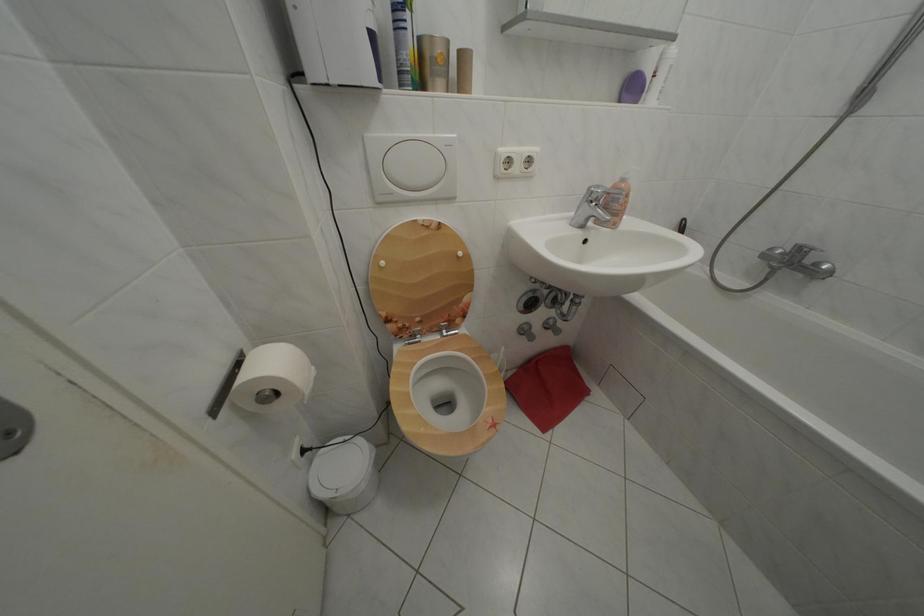
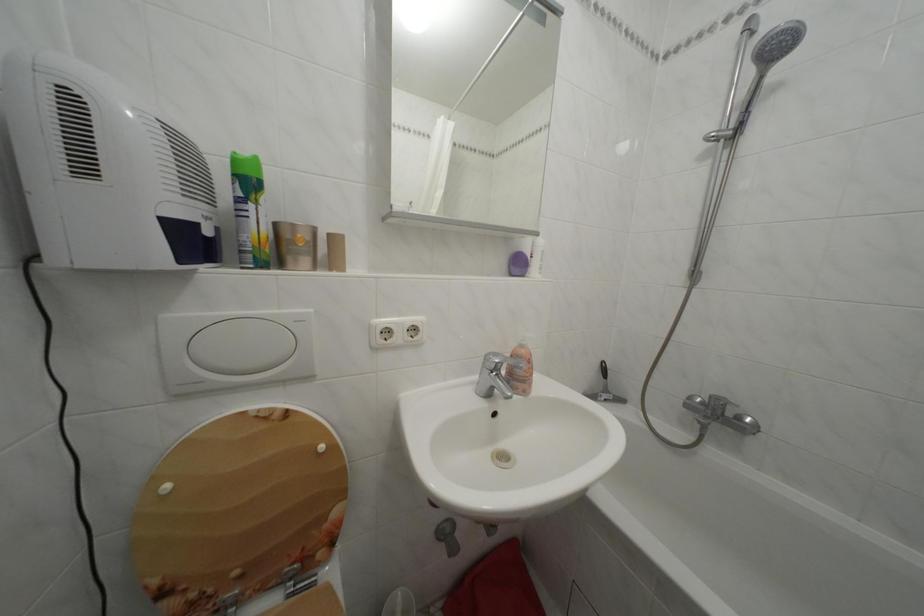
Question: The first image is from the beginning of the video and the second image is from the end. How did the camera likely rotate when shooting the video?

Choices:
 (A) Left
 (B) Right
 (C) Up
 (D) Down

Answer: (C)